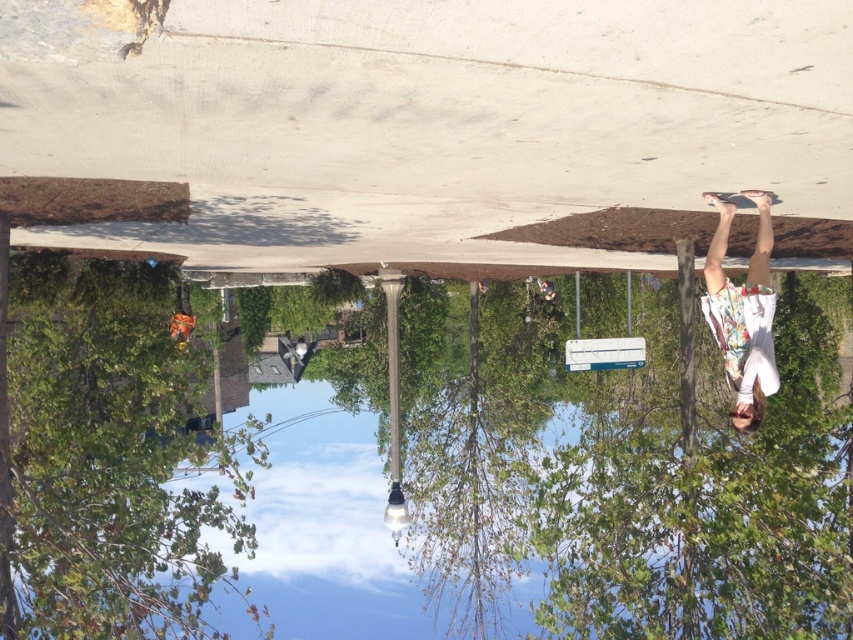
Question: Is green leafy tree at lower left smaller than floral-patterned shirt at right?

Choices:
 (A) no
 (B) yes

Answer: (B)

Question: Is green leafy tree at lower left bigger than floral-patterned shirt at right?

Choices:
 (A) no
 (B) yes

Answer: (A)

Question: Among these points, which one is nearest to the camera?

Choices:
 (A) (167, 372)
 (B) (761, 378)

Answer: (B)

Question: Among these points, which one is nearest to the camera?

Choices:
 (A) (721, 340)
 (B) (184, 454)

Answer: (A)

Question: Can you confirm if green leafy tree at lower left is thinner than floral-patterned shirt at right?

Choices:
 (A) no
 (B) yes

Answer: (B)